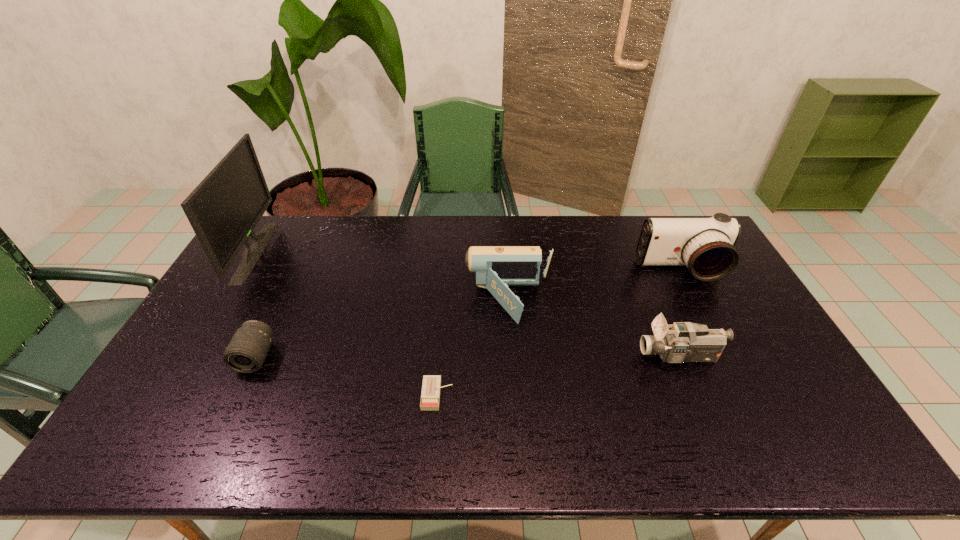
Select which camcorder appears as the closest to the leftmost object. Please provide its 2D coordinates. Your answer should be formatted as a tuple, i.e. [(x, y)], where the tuple contains the x and y coordinates of a point satisfying the conditions above.

[(496, 267)]

Where is `free spot that satisfies the following two spatial constraints: 1. on the surface of the tallest camcorder; 2. on the side of the third object from right to left with the flip-out screen`? free spot that satisfies the following two spatial constraints: 1. on the surface of the tallest camcorder; 2. on the side of the third object from right to left with the flip-out screen is located at coordinates (697, 301).

The height and width of the screenshot is (540, 960). What are the coordinates of `vacant region that satisfies the following two spatial constraints: 1. on the surface of the second tallest object; 2. on the side of the leftmost camcorder with the flip-out screen` in the screenshot? It's located at (697, 301).

The image size is (960, 540). I want to click on free region that satisfies the following two spatial constraints: 1. on the surface of the tallest camcorder; 2. on the front-facing side of the nearest camcorder, so click(725, 356).

The image size is (960, 540). What are the coordinates of `vacant area that satisfies the following two spatial constraints: 1. on the surface of the second tallest object; 2. on the side of the leftmost camcorder with the flip-out screen` in the screenshot? It's located at (697, 301).

Image resolution: width=960 pixels, height=540 pixels. I want to click on blank area in the image that satisfies the following two spatial constraints: 1. on the front-facing side of the nearest camcorder; 2. on the surface of the second shortest object, so click(x=680, y=357).